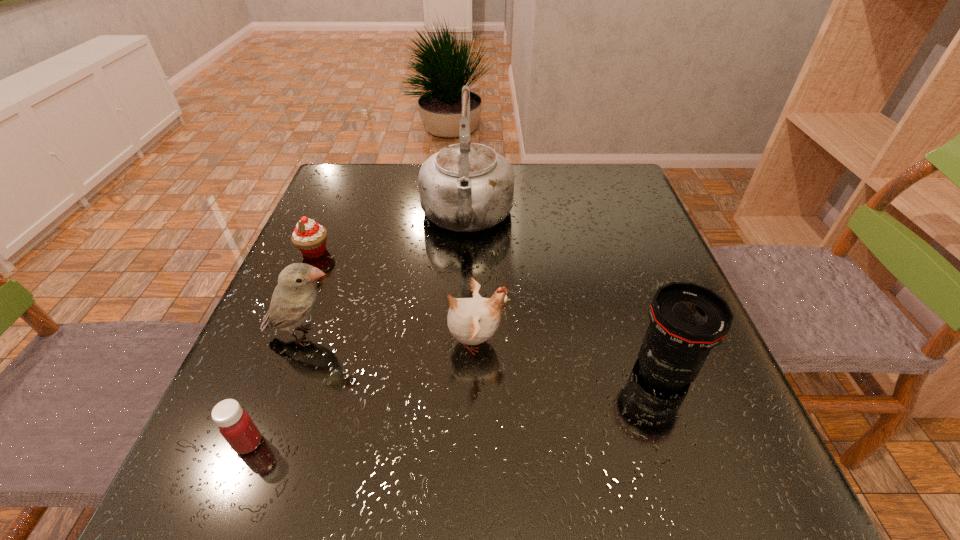
At what (x,y) coordinates should I click in order to perform the action: click on vacant space in between the medicine and the telephoto lens. Please return your answer as a coordinate pair (x, y). This screenshot has width=960, height=540. Looking at the image, I should click on (456, 406).

Image resolution: width=960 pixels, height=540 pixels. What are the coordinates of `free point between the telephoto lens and the left bird` in the screenshot? It's located at (485, 352).

This screenshot has height=540, width=960. Find the location of `free space between the taller bird and the shorter bird`. free space between the taller bird and the shorter bird is located at coordinates (390, 338).

This screenshot has height=540, width=960. I want to click on vacant area between the medicine and the cupcake, so click(281, 347).

Identify the location of free spot between the tallest object and the nearest object. (358, 330).

At what (x,y) coordinates should I click in order to perform the action: click on object that is the second closest to the left bird. Please return your answer as a coordinate pair (x, y). The height and width of the screenshot is (540, 960). Looking at the image, I should click on (309, 237).

Identify which object is the fifth closest to the rightmost object. Please provide its 2D coordinates. Your answer should be formatted as a tuple, i.e. [(x, y)], where the tuple contains the x and y coordinates of a point satisfying the conditions above.

[(309, 237)]

Locate an element on the screen. This screenshot has width=960, height=540. vacant space that satisfies the following two spatial constraints: 1. at the face of the taller bird; 2. on the right side of the rightmost object is located at coordinates (292, 369).

Identify the location of blank area in the image that satisfies the following two spatial constraints: 1. at the spout of the kettle; 2. on the right side of the rightmost object. (462, 369).

Where is `free space that satisfies the following two spatial constraints: 1. at the beak of the rightmost object; 2. on the right side of the right bird`? The height and width of the screenshot is (540, 960). free space that satisfies the following two spatial constraints: 1. at the beak of the rightmost object; 2. on the right side of the right bird is located at coordinates (475, 369).